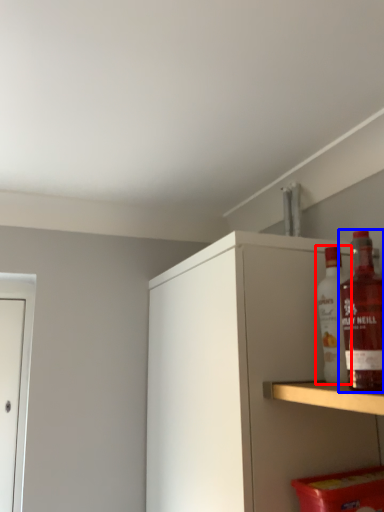
Question: Which object is further to the camera taking this photo, bottle (highlighted by a red box) or bottle (highlighted by a blue box)?

Choices:
 (A) bottle
 (B) bottle

Answer: (A)